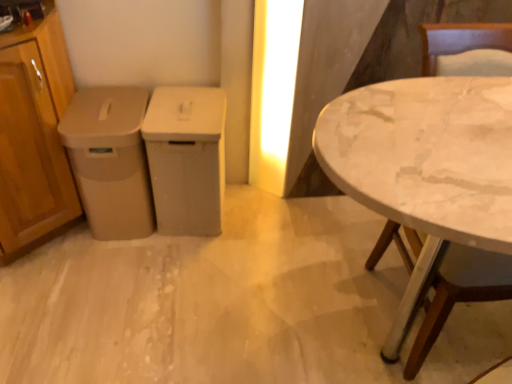
The image size is (512, 384). I want to click on empty space that is ontop of matte plastic trash can at center, which is counted as the 1th cabinetry, starting from the right (from a real-world perspective), so click(x=185, y=105).